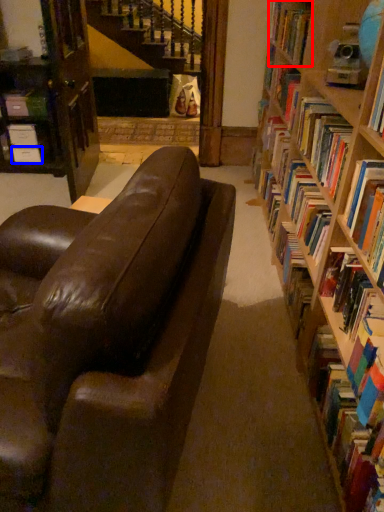
Question: Which object is further to the camera taking this photo, book (highlighted by a red box) or paperback book (highlighted by a blue box)?

Choices:
 (A) book
 (B) paperback book

Answer: (B)